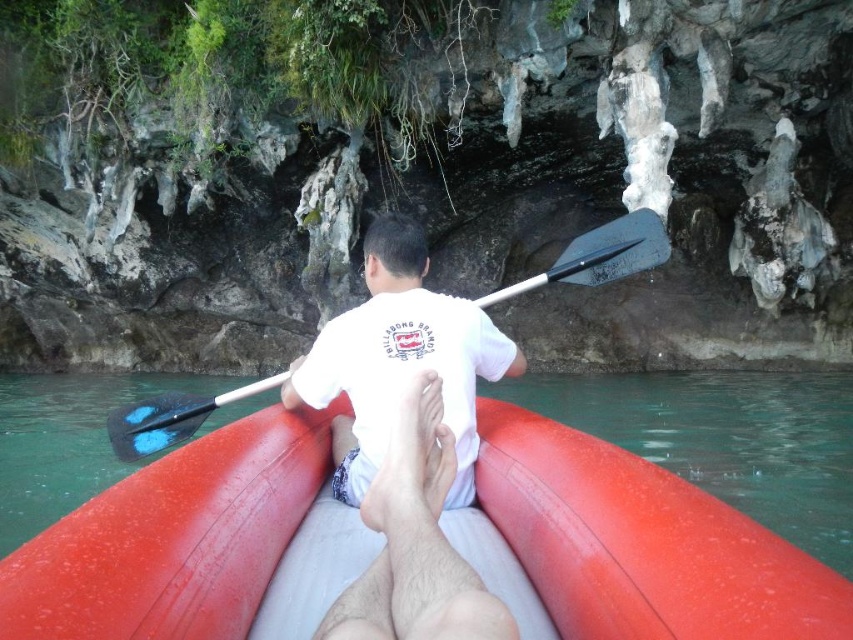
In the scene shown: You are a photographer planning to take a photo of the scene. You want to ensure that the rubber boat at center and the white cotton shirt at center are both visible in the frame. Based on their positions, which object should you focus on first to ensure both are in focus?

The rubber boat at center is located below the white cotton shirt at center. To ensure both are in focus, you should focus on the white cotton shirt at center first since it is closer to the camera, and the rubber boat at center will naturally fall into the depth of field if focused on the shirt.

You are a photographer trying to capture a clear shot of both the white cotton shirt at center and the black wood paddle at center. Given their sizes, which object should you focus on first to ensure it fits within your camera frame?

The white cotton shirt at center is smaller than the black wood paddle at center, so you should focus on the white cotton shirt at center first to ensure it fits within the camera frame since it is smaller and might require more precise framing.

You are planning to store the rubber boat at center and the black wood paddle at center in a storage compartment. The compartment has a width of 1.2 meters. Which item will require more space horizontally?

The rubber boat at center requires more horizontal space because its width surpasses that of the black wood paddle at center.